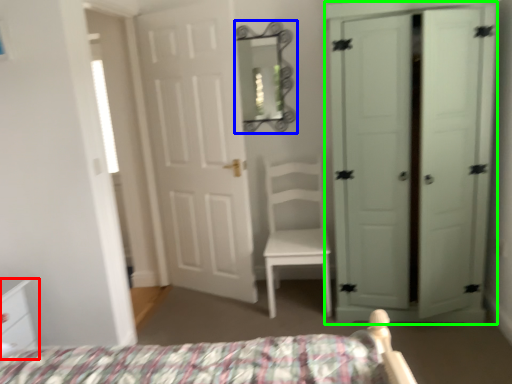
Question: Which is nearer to the nightstand (highlighted by a red box)? mirror (highlighted by a blue box) or door (highlighted by a green box).

Choices:
 (A) mirror
 (B) door

Answer: (A)